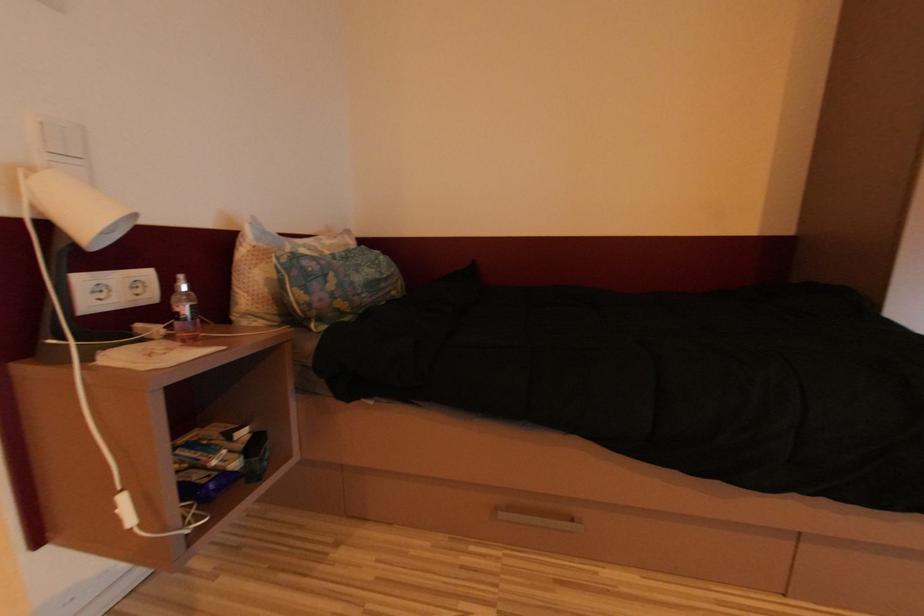
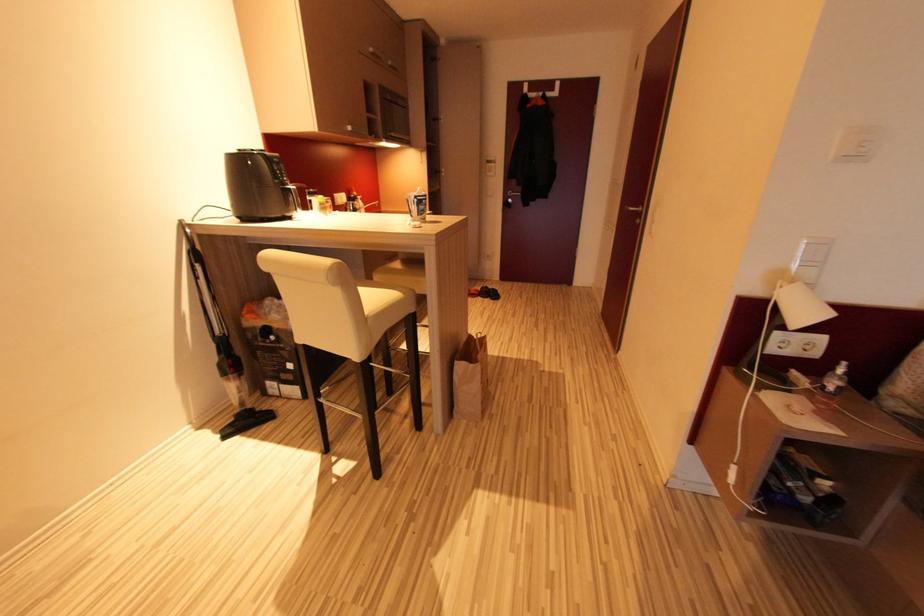
Looking at this image, the first image is from the beginning of the video and the second image is from the end. How did the camera likely rotate when shooting the video?

The camera rotated toward left-down.